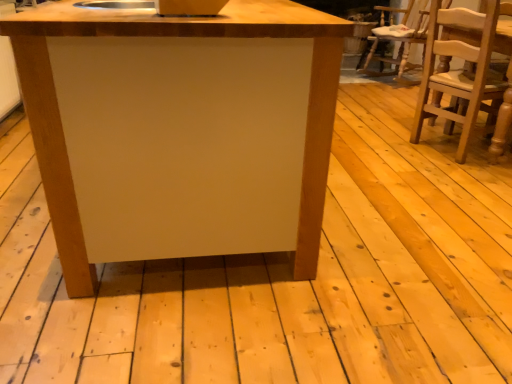
Locate an element on the screen. The width and height of the screenshot is (512, 384). spots to the right of matte wood table at center is located at coordinates (402, 195).